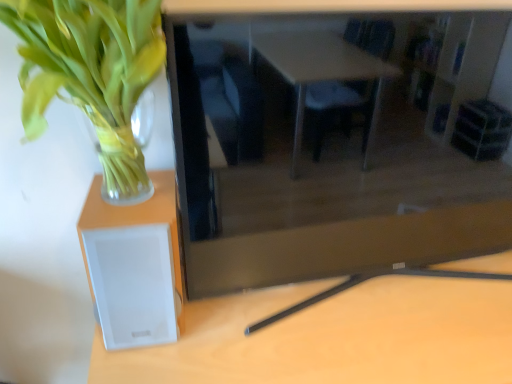
Where is `free point below matte black tv at center (from a real-world perspective)`? free point below matte black tv at center (from a real-world perspective) is located at coordinates (379, 296).